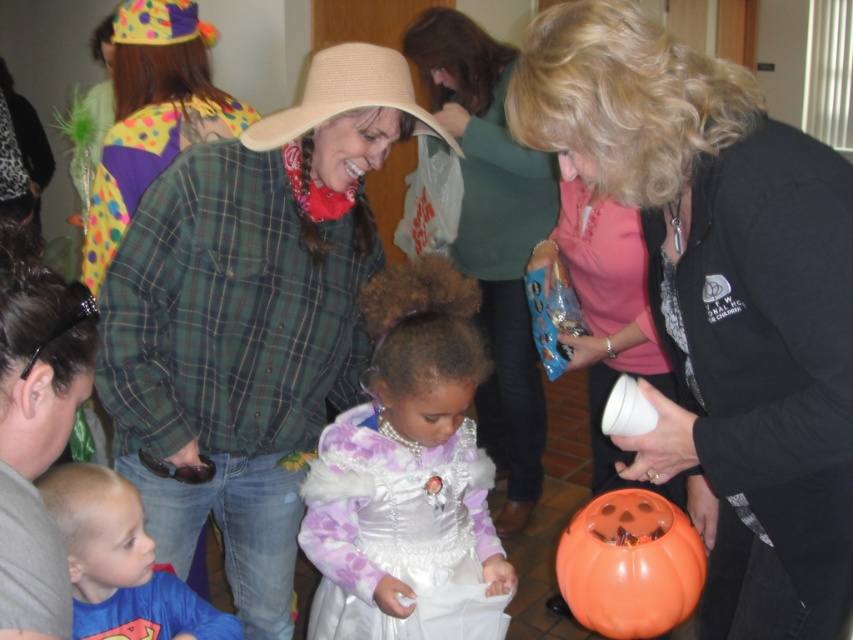
Question: Considering the real-world distances, which object is farthest from the plaid flannel shirt at center?

Choices:
 (A) green plaid shirt at center
 (B) matte green shirt at center
 (C) orange matte pumpkin at lower right
 (D) blue cotton shirt at lower left

Answer: (C)

Question: Is purple satin dress at center further to the viewer compared to orange matte pumpkin at lower right?

Choices:
 (A) yes
 (B) no

Answer: (A)

Question: Which of the following is the farthest from the observer?

Choices:
 (A) matte green shirt at center
 (B) blue cotton shirt at lower left

Answer: (A)

Question: Which object appears farthest from the camera in this image?

Choices:
 (A) green plaid shirt at center
 (B) purple satin dress at center

Answer: (A)

Question: Is green plaid shirt at center to the left of plaid flannel shirt at center from the viewer's perspective?

Choices:
 (A) yes
 (B) no

Answer: (B)

Question: Does purple satin dress at center have a smaller size compared to matte green shirt at center?

Choices:
 (A) no
 (B) yes

Answer: (B)